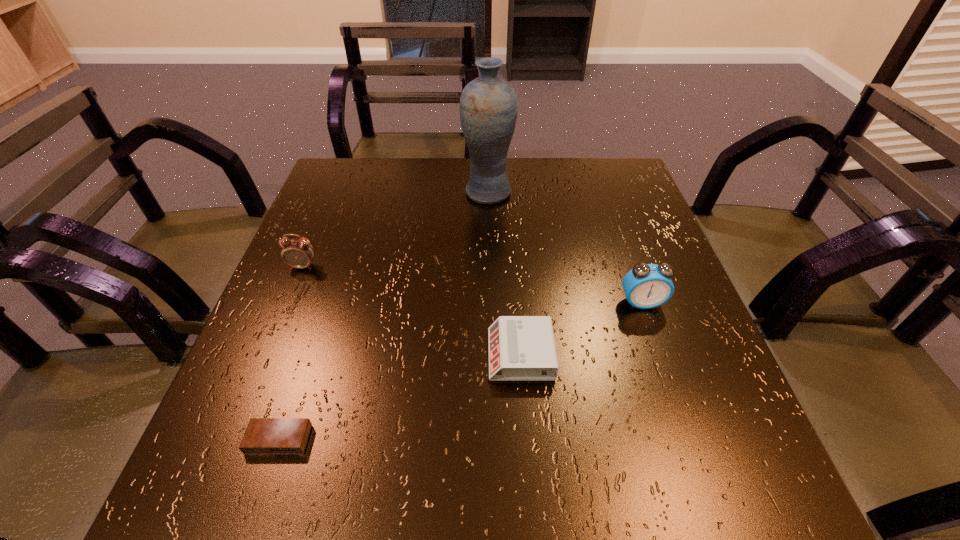
Where is `the tallest object`? This screenshot has height=540, width=960. the tallest object is located at coordinates coord(488,107).

Find the location of a particular element. The width and height of the screenshot is (960, 540). the farthest object is located at coordinates (488, 107).

Where is `the rightmost object`? This screenshot has width=960, height=540. the rightmost object is located at coordinates (646, 286).

Locate an element on the screen. the third nearest object is located at coordinates (x=646, y=286).

Find the location of a particular element. Image resolution: width=960 pixels, height=540 pixels. the farthest alarm clock is located at coordinates (298, 253).

What are the coordinates of `the second shortest object` in the screenshot? It's located at (521, 348).

Find the location of a particular element. Image resolution: width=960 pixels, height=540 pixels. the fourth farthest object is located at coordinates (521, 348).

Image resolution: width=960 pixels, height=540 pixels. Find the location of `the shortest alarm clock`. the shortest alarm clock is located at coordinates (263, 435).

Image resolution: width=960 pixels, height=540 pixels. What are the coordinates of `the nearest object` in the screenshot? It's located at (263, 435).

This screenshot has width=960, height=540. In order to click on free space located on the left of the farthest object in this screenshot , I will do `click(345, 192)`.